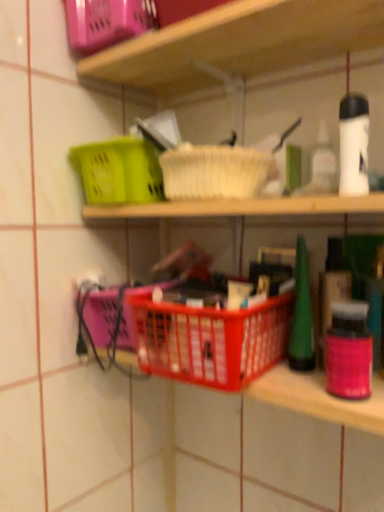
Question: Considering the relative sizes of red plastic basket at center and matte plastic basket at upper left in the image provided, is red plastic basket at center wider than matte plastic basket at upper left?

Choices:
 (A) no
 (B) yes

Answer: (B)

Question: Considering the relative positions of red plastic basket at center and matte plastic basket at upper left in the image provided, is red plastic basket at center to the left of matte plastic basket at upper left from the viewer's perspective?

Choices:
 (A) no
 (B) yes

Answer: (A)

Question: Considering the relative sizes of red plastic basket at center and matte plastic basket at upper left in the image provided, is red plastic basket at center thinner than matte plastic basket at upper left?

Choices:
 (A) yes
 (B) no

Answer: (B)

Question: Is red plastic basket at center facing towards matte plastic basket at upper left?

Choices:
 (A) yes
 (B) no

Answer: (B)

Question: Can you confirm if red plastic basket at center is smaller than matte plastic basket at upper left?

Choices:
 (A) yes
 (B) no

Answer: (B)

Question: Does red plastic basket at center lie behind matte plastic basket at upper left?

Choices:
 (A) no
 (B) yes

Answer: (A)

Question: Does plastic basket at center appear on the right side of red plastic basket at center?

Choices:
 (A) no
 (B) yes

Answer: (A)

Question: Is plastic basket at center located outside red plastic basket at center?

Choices:
 (A) no
 (B) yes

Answer: (B)

Question: Can you confirm if plastic basket at center is smaller than red plastic basket at center?

Choices:
 (A) no
 (B) yes

Answer: (A)

Question: Is plastic basket at center to the left of red plastic basket at center from the viewer's perspective?

Choices:
 (A) yes
 (B) no

Answer: (A)

Question: Does plastic basket at center contain red plastic basket at center?

Choices:
 (A) no
 (B) yes

Answer: (B)

Question: Considering the relative sizes of plastic basket at center and red plastic basket at center in the image provided, is plastic basket at center bigger than red plastic basket at center?

Choices:
 (A) no
 (B) yes

Answer: (B)

Question: Is plastic basket at center at the left side of matte plastic basket at upper left?

Choices:
 (A) yes
 (B) no

Answer: (B)